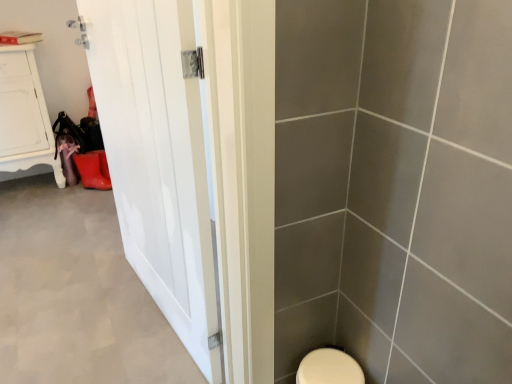
Question: Is white matte door at left oriented away from white wood cabinet at upper left?

Choices:
 (A) no
 (B) yes

Answer: (A)

Question: Considering the relative sizes of white matte door at left and white wood cabinet at upper left in the image provided, is white matte door at left thinner than white wood cabinet at upper left?

Choices:
 (A) yes
 (B) no

Answer: (B)

Question: Does white matte door at left touch white wood cabinet at upper left?

Choices:
 (A) yes
 (B) no

Answer: (B)

Question: Is white wood cabinet at upper left located within white matte door at left?

Choices:
 (A) no
 (B) yes

Answer: (A)

Question: From the image's perspective, does white matte door at left appear lower than white wood cabinet at upper left?

Choices:
 (A) yes
 (B) no

Answer: (A)

Question: Choose the correct answer: Is white glossy door at left inside white matte door at left or outside it?

Choices:
 (A) outside
 (B) inside

Answer: (A)

Question: Looking at the image, does white glossy door at left seem bigger or smaller compared to white matte door at left?

Choices:
 (A) small
 (B) big

Answer: (B)

Question: Considering the positions of white glossy door at left and white matte door at left in the image, is white glossy door at left taller or shorter than white matte door at left?

Choices:
 (A) tall
 (B) short

Answer: (A)

Question: In the image, is white glossy door at left on the left side or the right side of white matte door at left?

Choices:
 (A) left
 (B) right

Answer: (B)

Question: Is white wood cabinet at upper left taller or shorter than white matte door at left?

Choices:
 (A) tall
 (B) short

Answer: (A)

Question: From the image's perspective, relative to white matte door at left, is white wood cabinet at upper left above or below?

Choices:
 (A) below
 (B) above

Answer: (B)

Question: From a real-world perspective, is white wood cabinet at upper left physically located above or below white matte door at left?

Choices:
 (A) above
 (B) below

Answer: (A)

Question: Is white wood cabinet at upper left bigger or smaller than white matte door at left?

Choices:
 (A) small
 (B) big

Answer: (B)

Question: Is point (117, 316) positioned closer to the camera than point (89, 33)?

Choices:
 (A) closer
 (B) farther

Answer: (B)

Question: In terms of width, does white matte door at left look wider or thinner when compared to white glossy door at left?

Choices:
 (A) wide
 (B) thin

Answer: (A)